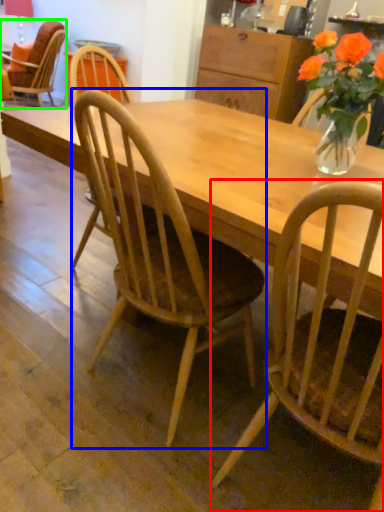
Question: Which is nearer to the chair (highlighted by a red box)? chair (highlighted by a blue box) or chair (highlighted by a green box).

Choices:
 (A) chair
 (B) chair

Answer: (A)